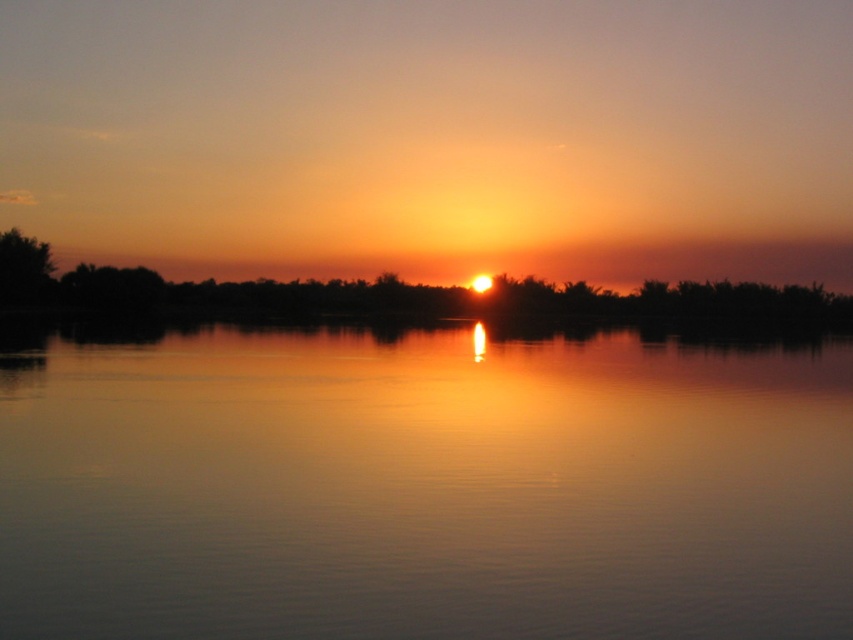
Does glossy water at center have a lesser height compared to green leafy tree at left?

Yes.

The height and width of the screenshot is (640, 853). What do you see at coordinates (422, 484) in the screenshot? I see `glossy water at center` at bounding box center [422, 484].

The height and width of the screenshot is (640, 853). In order to click on glossy water at center in this screenshot , I will do point(422,484).